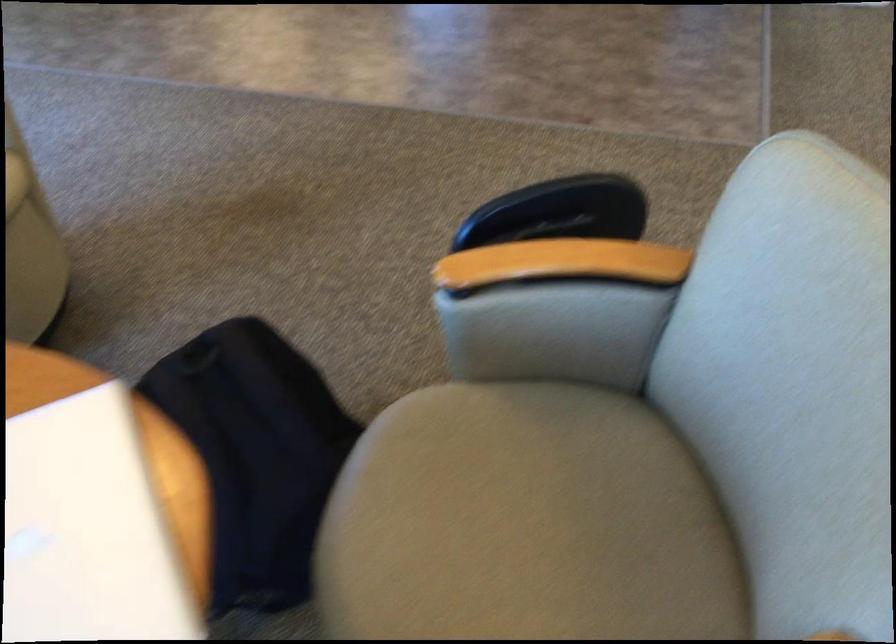
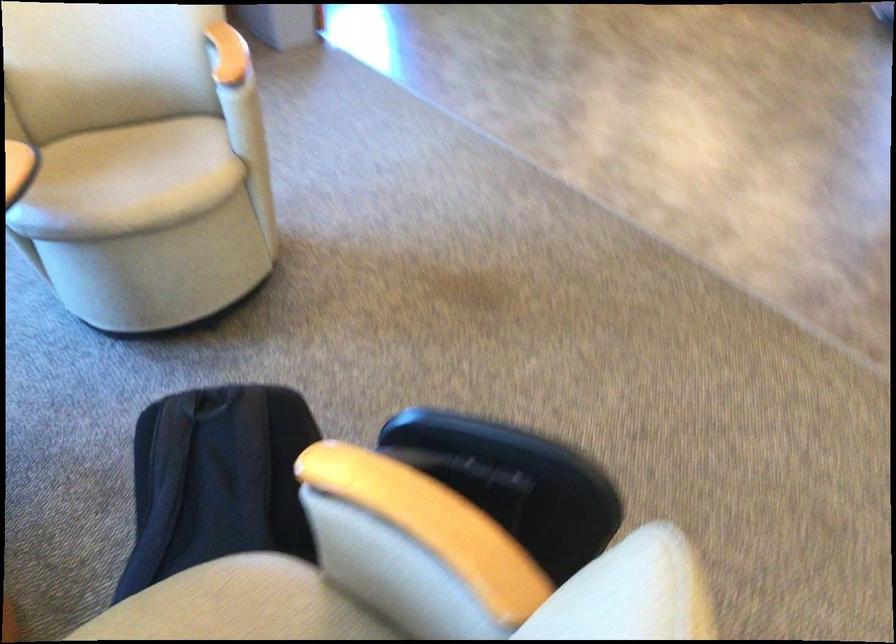
Find the pixel in the second image that matches point (248, 428) in the first image.

(217, 480)